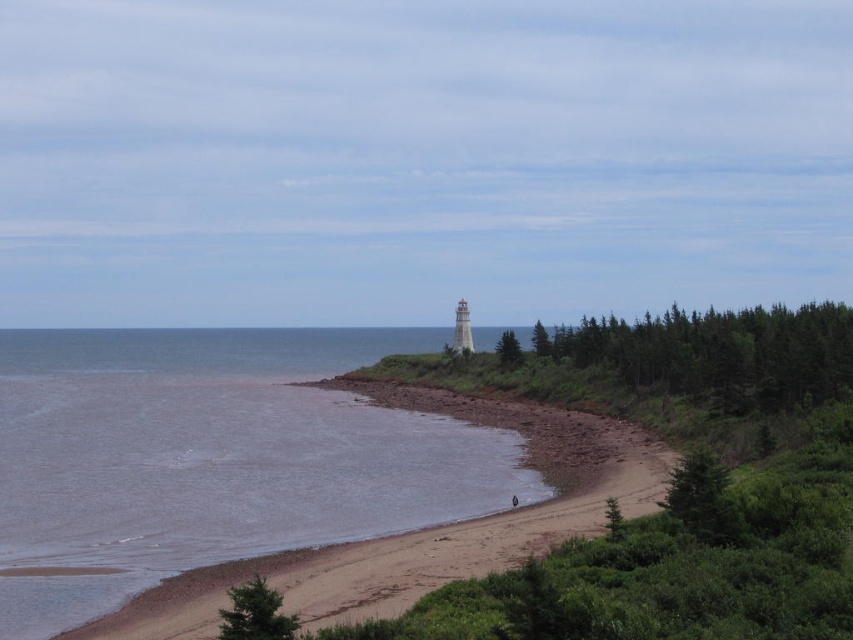
Based on the photo, can you confirm if green matte tree at lower left is wider than green leafy tree at center?

Yes, green matte tree at lower left is wider than green leafy tree at center.

Describe the element at coordinates (254, 612) in the screenshot. I see `green matte tree at lower left` at that location.

Identify the location of green matte tree at lower left. This screenshot has height=640, width=853. (254, 612).

Which is behind, point (672, 506) or point (259, 637)?

The point (672, 506) is behind.

Is green matte tree at lower right shorter than green matte tree at lower left?

Yes, green matte tree at lower right is shorter than green matte tree at lower left.

Between point (705, 540) and point (287, 634), which one is positioned in front?

Point (287, 634) is in front.

This screenshot has width=853, height=640. In order to click on green matte tree at lower right in this screenshot , I will do `click(701, 499)`.

Looking at this image, who is more distant from viewer, (251, 538) or (514, 353)?

Point (514, 353)

Which is more to the left, brown sand at lower left or green leafy tree at center?

From the viewer's perspective, brown sand at lower left appears more on the left side.

Which is in front, point (90, 368) or point (498, 348)?

Point (498, 348) is more forward.

This screenshot has width=853, height=640. In order to click on brown sand at lower left in this screenshot , I will do `click(212, 458)`.